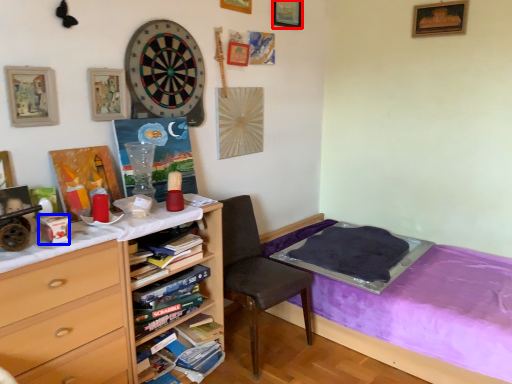
Question: Which object is closer to the camera taking this photo, picture frame (highlighted by a red box) or box (highlighted by a blue box)?

Choices:
 (A) picture frame
 (B) box

Answer: (B)